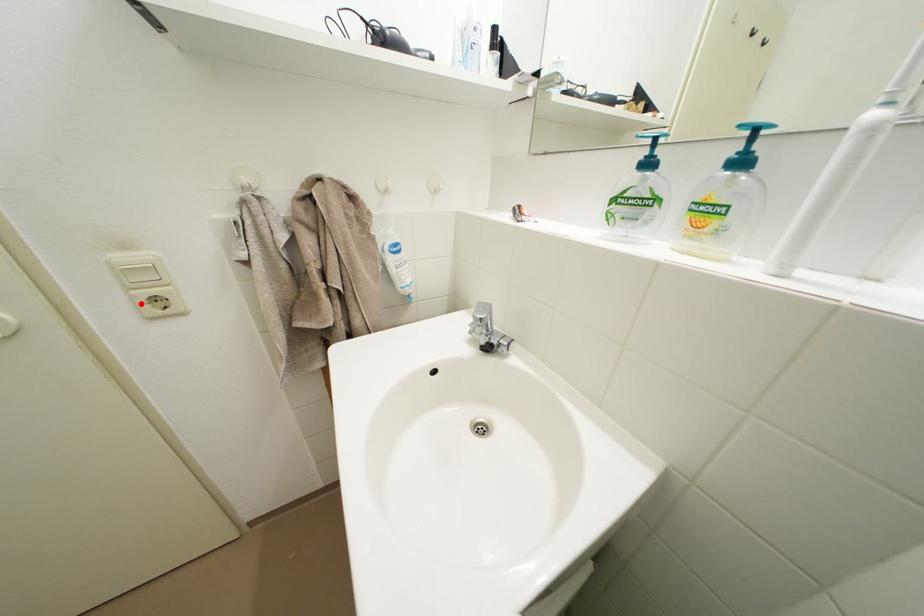
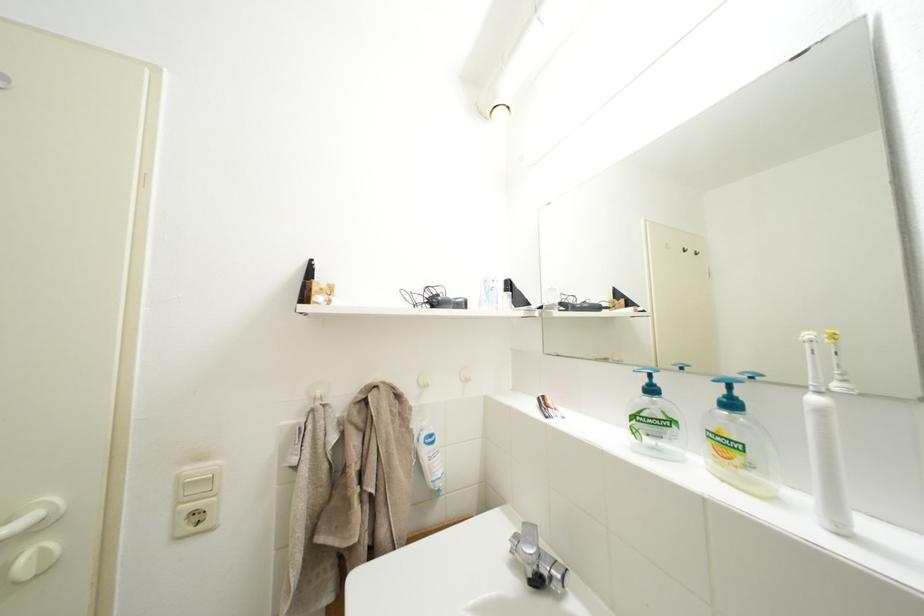
The point at the highlighted location is marked in the first image. Where is the corresponding point in the second image?

(185, 519)